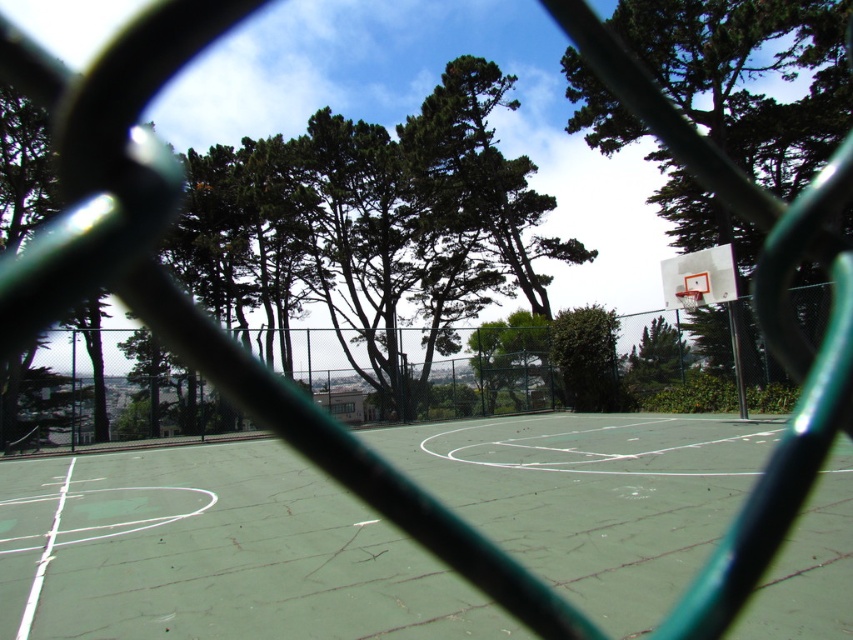
Is green cracked asphalt basketball court at center smaller than green chain-link fence at center?

Indeed, green cracked asphalt basketball court at center has a smaller size compared to green chain-link fence at center.

How distant is green cracked asphalt basketball court at center from green chain-link fence at center?

The distance of green cracked asphalt basketball court at center from green chain-link fence at center is 10.59 meters.

Who is more distant from viewer, (216,458) or (485,328)?

Point (485,328)

Locate an element on the screen. The image size is (853, 640). green cracked asphalt basketball court at center is located at coordinates (241, 556).

Measure the distance between point (335,314) and camera.

They are 44.27 meters apart.

Is green leafy tree at upper center closer to the viewer compared to green chain-link fence at center?

No, green leafy tree at upper center is further to the viewer.

Who is more distant from viewer, (306,264) or (86,380)?

Positioned behind is point (306,264).

Locate an element on the screen. green leafy tree at upper center is located at coordinates (374, 221).

Does green cracked asphalt basketball court at center appear on the right side of green leafy tree at upper right?

In fact, green cracked asphalt basketball court at center is to the left of green leafy tree at upper right.

Which is more to the left, green cracked asphalt basketball court at center or green leafy tree at upper right?

green cracked asphalt basketball court at center

At what (x,y) coordinates should I click in order to perform the action: click on green cracked asphalt basketball court at center. Please return your answer as a coordinate pair (x, y). Image resolution: width=853 pixels, height=640 pixels. Looking at the image, I should click on (241, 556).